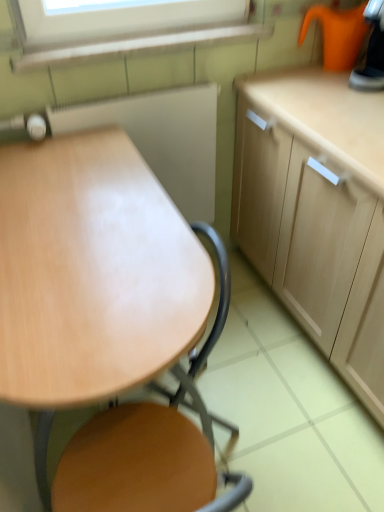
You are a GUI agent. You are given a task and a screenshot of the screen. Output one action in this format:
    pyautogui.click(x=<x>, y=<y>)
    Task: Click on the light wood cabinet at right
    
    Given the screenshot: What is the action you would take?
    pyautogui.click(x=320, y=214)

Describe the element at coordinates (152, 444) in the screenshot. I see `wooden at center` at that location.

You are a GUI agent. You are given a task and a screenshot of the screen. Output one action in this format:
    pyautogui.click(x=<x>, y=<y>)
    Task: Click on the light wood cabinet at right
    This screenshot has width=384, height=512.
    Given the screenshot: What is the action you would take?
    pyautogui.click(x=320, y=214)

Is wooden at center oriented towards wooden table at center?

Yes, wooden at center is turned towards wooden table at center.

Considering the positions of points (156, 499) and (27, 283), is point (156, 499) closer to camera compared to point (27, 283)?

Yes, it is.

Is wooden at center positioned behind wooden table at center?

Yes, the depth of wooden at center is greater than that of wooden table at center.

From a real-world perspective, who is located higher, wooden at center or wooden board at center, the 2th appliance when ordered from top to bottom?

wooden board at center, the 2th appliance when ordered from top to bottom, is physically above.

Is wooden at center wider than wooden board at center, the 1th appliance from the left?

Yes, wooden at center is wider than wooden board at center, the 1th appliance from the left.

Image resolution: width=384 pixels, height=512 pixels. I want to click on chair that appears in front of the wooden board at center, which ranks as the second appliance in right-to-left order, so click(152, 444).

From the image's perspective, which is above, wooden at center or wooden board at center, which ranks as the 1th appliance in bottom-to-top order?

wooden board at center, which ranks as the 1th appliance in bottom-to-top order, appears higher in the image.

Is light wood cabinet at right completely or partially inside wooden table at center?

No, light wood cabinet at right is not a part of wooden table at center.

Which is more to the left, wooden table at center or light wood cabinet at right?

wooden table at center.

From the image's perspective, which object appears higher, wooden table at center or light wood cabinet at right?

From the image's view, light wood cabinet at right is above.

Which is nearer, (63, 214) or (313, 248)?

Point (63, 214).

How distant is light wood cabinet at right from wooden table at center?

65.59 centimeters.

From a real-world perspective, is light wood cabinet at right on wooden table at center?

Correct, in the physical world, light wood cabinet at right is higher than wooden table at center.

Between light wood cabinet at right and wooden table at center, which one has more height?

Standing taller between the two is light wood cabinet at right.

Does point (290, 191) appear closer or farther from the camera than point (57, 320)?

Clearly, point (290, 191) is more distant from the camera than point (57, 320).

Can you confirm if wooden table at center is positioned to the right of wooden board at center, which ranks as the second appliance in right-to-left order?

No.

Is wooden table at center aimed at wooden board at center, which ranks as the 1th appliance in bottom-to-top order?

No.

Based on the photo, is the depth of wooden table at center less than that of wooden board at center, which ranks as the second appliance in right-to-left order?

Yes, wooden table at center is closer to the camera.

Is wooden board at center, the 1th appliance from the left, wider than orange plastic kettle at upper right, positioned as the 1th appliance in top-to-bottom order?

Incorrect, the width of wooden board at center, the 1th appliance from the left, does not surpass that of orange plastic kettle at upper right, positioned as the 1th appliance in top-to-bottom order.

Where is `appliance on the right of wooden board at center, which ranks as the 1th appliance in bottom-to-top order`? This screenshot has width=384, height=512. appliance on the right of wooden board at center, which ranks as the 1th appliance in bottom-to-top order is located at coordinates (372, 52).

Does wooden board at center, which ranks as the 1th appliance in bottom-to-top order, appear on the left side of orange plastic kettle at upper right, the second appliance in the bottom-to-top sequence?

Correct, you'll find wooden board at center, which ranks as the 1th appliance in bottom-to-top order, to the left of orange plastic kettle at upper right, the second appliance in the bottom-to-top sequence.

At what (x,y) coordinates should I click in order to perform the action: click on chair on the left of orange plastic kettle at upper right, the 2th appliance from the left. Please return your answer as a coordinate pair (x, y). The height and width of the screenshot is (512, 384). Looking at the image, I should click on (152, 444).

Is orange plastic kettle at upper right, the first appliance positioned from the right, inside or outside of wooden at center?

orange plastic kettle at upper right, the first appliance positioned from the right, cannot be found inside wooden at center.

Looking at this image, from a real-world perspective, relative to wooden at center, is orange plastic kettle at upper right, the 2th appliance from the left, vertically above or below?

orange plastic kettle at upper right, the 2th appliance from the left, is above wooden at center.

How many degrees apart are the facing directions of orange plastic kettle at upper right, the second appliance in the bottom-to-top sequence, and wooden at center?

The facing directions of orange plastic kettle at upper right, the second appliance in the bottom-to-top sequence, and wooden at center are 1 degrees apart.

Image resolution: width=384 pixels, height=512 pixels. I want to click on chair below the wooden table at center (from the image's perspective), so click(x=152, y=444).

Image resolution: width=384 pixels, height=512 pixels. In order to click on chair below the wooden board at center, the 2th appliance when ordered from top to bottom (from a real-world perspective) in this screenshot , I will do `click(152, 444)`.

Estimate the real-world distances between objects in this image. Which object is further from wooden at center, orange plastic kettle at upper right, the first appliance positioned from the right, or wooden board at center, the 2th appliance when ordered from top to bottom?

orange plastic kettle at upper right, the first appliance positioned from the right, lies further to wooden at center than the other object.

Which object lies further to the anchor point wooden table at center, light wood cabinet at right or wooden at center?

light wood cabinet at right lies further to wooden table at center than the other object.

Looking at this image, looking at the image, which one is located closer to light wood cabinet at right, wooden board at center, the 2th appliance when ordered from top to bottom, or orange plastic kettle at upper right, the first appliance positioned from the right?

Among the two, wooden board at center, the 2th appliance when ordered from top to bottom, is located nearer to light wood cabinet at right.

Based on their spatial positions, is wooden board at center, the 2th appliance when ordered from top to bottom, or light wood cabinet at right further from wooden table at center?

The object further to wooden table at center is light wood cabinet at right.

Looking at the image, which one is located further to orange plastic kettle at upper right, the 2th appliance from the left, wooden board at center, which ranks as the second appliance in right-to-left order, or light wood cabinet at right?

Among the two, wooden board at center, which ranks as the second appliance in right-to-left order, is located further to orange plastic kettle at upper right, the 2th appliance from the left.

From the image, which object appears to be farther from wooden table at center, wooden board at center, the 1th appliance from the left, or wooden at center?

Among the two, wooden board at center, the 1th appliance from the left, is located further to wooden table at center.

From the image, which object appears to be nearer to wooden board at center, the 2th appliance when ordered from top to bottom, orange plastic kettle at upper right, positioned as the 1th appliance in top-to-bottom order, or light wood cabinet at right?

Based on the image, light wood cabinet at right appears to be nearer to wooden board at center, the 2th appliance when ordered from top to bottom.

Considering their positions, is wooden at center positioned further to orange plastic kettle at upper right, positioned as the 1th appliance in top-to-bottom order, than wooden board at center, the 2th appliance when ordered from top to bottom?

Among the two, wooden at center is located further to orange plastic kettle at upper right, positioned as the 1th appliance in top-to-bottom order.

Find the location of a particular element. The image size is (384, 512). appliance that lies between orange plastic kettle at upper right, the first appliance positioned from the right, and wooden at center from top to bottom is located at coordinates (162, 138).

This screenshot has width=384, height=512. Find the location of `appliance between wooden table at center and orange plastic kettle at upper right, positioned as the 1th appliance in top-to-bottom order`. appliance between wooden table at center and orange plastic kettle at upper right, positioned as the 1th appliance in top-to-bottom order is located at coordinates (162, 138).

Locate an element on the screen. This screenshot has height=512, width=384. round table between orange plastic kettle at upper right, the 2th appliance from the left, and wooden at center in the up-down direction is located at coordinates (92, 272).

Identify the location of chair between wooden table at center and wooden board at center, which ranks as the 1th appliance in bottom-to-top order, from front to back. point(152,444).